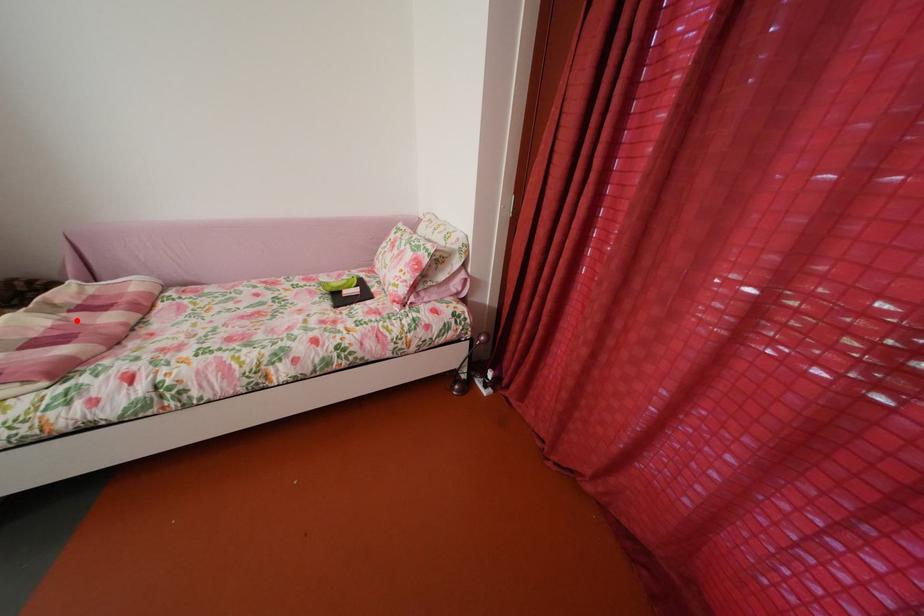
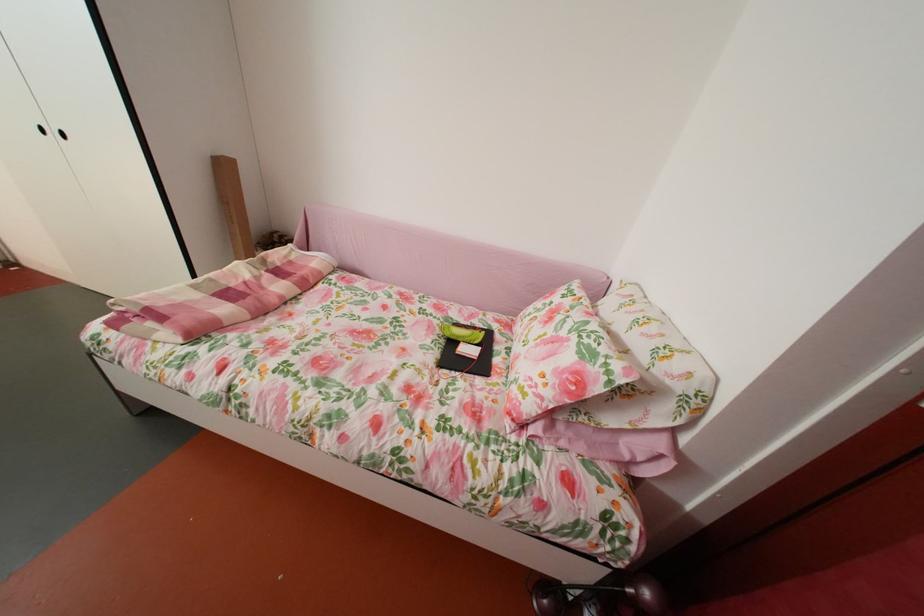
Locate, in the second image, the point that corresponds to the highlighted location in the first image.

(274, 278)